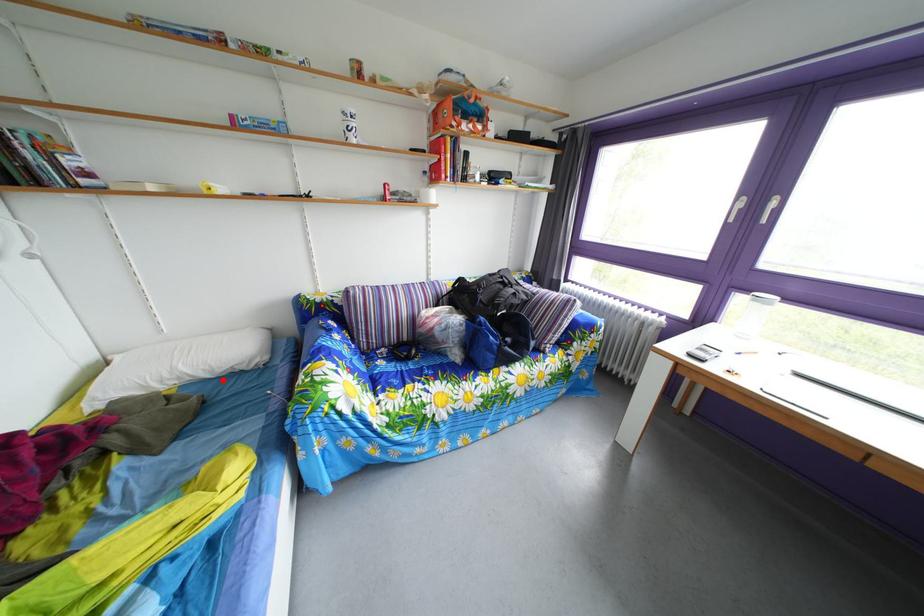
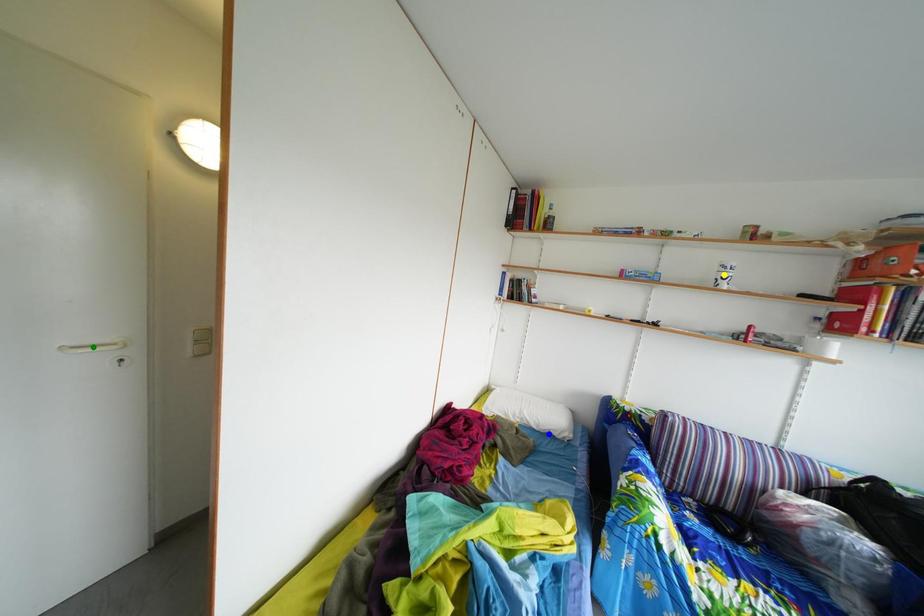
Question: I am providing you with two images of the same scene from different viewpoints. A red point is marked on the first image. You are given multiple points on the second image. Can you choose the point in image 2 that corresponds to the point in image 1?

Choices:
 (A) blue point
 (B) yellow point
 (C) green point

Answer: (A)